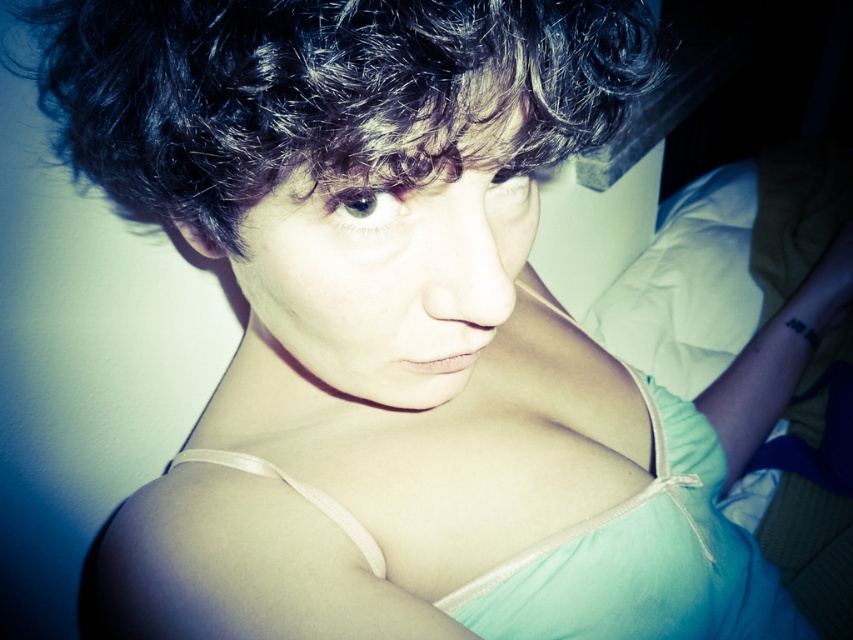
Question: Can you confirm if dark curly hair at upper center is positioned to the left of smooth skin face at center?

Choices:
 (A) no
 (B) yes

Answer: (B)

Question: Which object appears farthest from the camera in this image?

Choices:
 (A) light teal fabric dress at center
 (B) smooth skin face at center

Answer: (A)

Question: Among these points, which one is nearest to the camera?

Choices:
 (A) (573, 88)
 (B) (293, 211)
 (C) (672, 609)

Answer: (B)

Question: Can you confirm if smooth skin face at center is positioned above light teal fabric dress at center?

Choices:
 (A) no
 (B) yes

Answer: (B)

Question: Does dark curly hair at upper center have a greater width compared to smooth skin face at center?

Choices:
 (A) yes
 (B) no

Answer: (A)

Question: Which point is farther to the camera?

Choices:
 (A) (482, 124)
 (B) (682, 461)

Answer: (B)